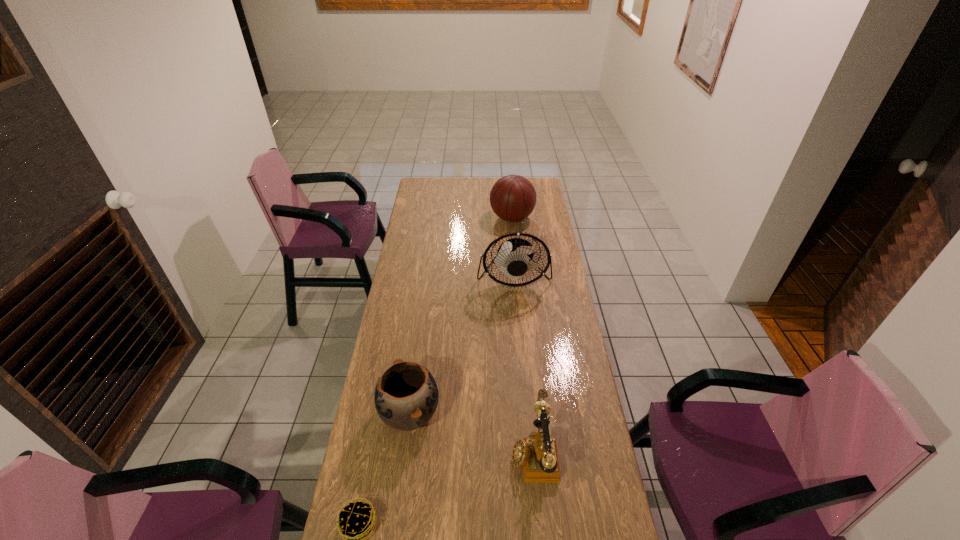
Find the location of `the fourth nearest object`. the fourth nearest object is located at coordinates (512, 259).

Where is `the tallest object`? Image resolution: width=960 pixels, height=540 pixels. the tallest object is located at coordinates (512, 259).

Where is `the fourth shortest object`? The width and height of the screenshot is (960, 540). the fourth shortest object is located at coordinates tap(512, 198).

I want to click on the farthest object, so click(512, 198).

Find the location of `telephone`. telephone is located at coordinates (538, 456).

Where is `pottery`? pottery is located at coordinates (406, 396).

Where is `vacant space located 0.340m in front of the tallest object, directing airflow`? Image resolution: width=960 pixels, height=540 pixels. vacant space located 0.340m in front of the tallest object, directing airflow is located at coordinates (521, 358).

This screenshot has width=960, height=540. In order to click on vacant space located on the left of the farthest object in this screenshot , I will do `click(466, 218)`.

Locate an element on the screen. This screenshot has height=540, width=960. vacant region located on the dial number of the telephone is located at coordinates (461, 451).

Identify the location of free spot located 0.320m on the dial number of the telephone. Image resolution: width=960 pixels, height=540 pixels. (411, 451).